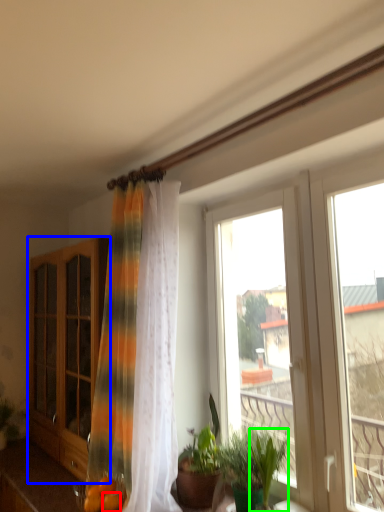
Question: Which object is positioned closest to citrus fruit (highlighted by a red box)? Select from cabinetry (highlighted by a blue box) and plant (highlighted by a green box).

Choices:
 (A) cabinetry
 (B) plant

Answer: (B)